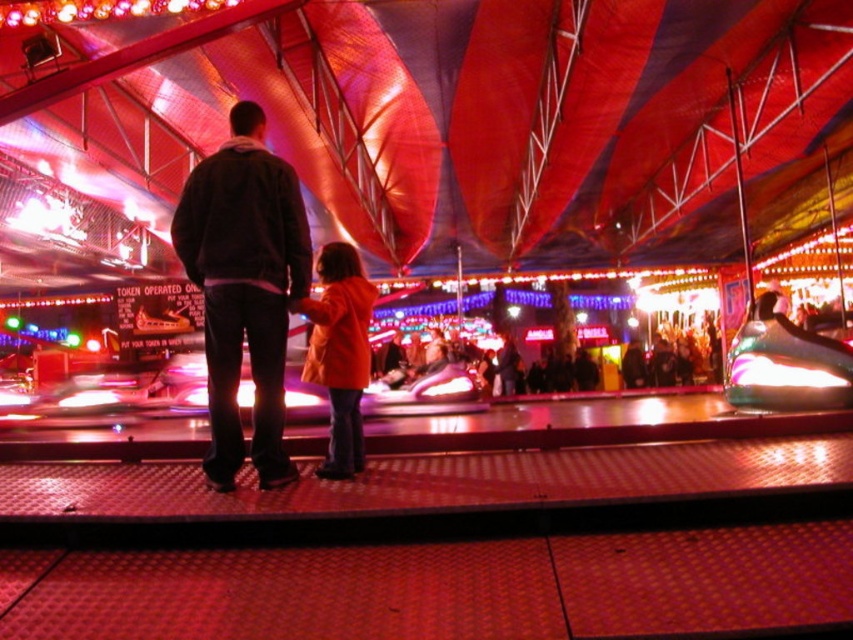
Who is more forward, (258,417) or (329,259)?

Point (258,417)

Is point (210, 438) farther from viewer compared to point (341, 260)?

Yes, it is.

This screenshot has height=640, width=853. I want to click on dark gray hoodie at center, so (x=244, y=288).